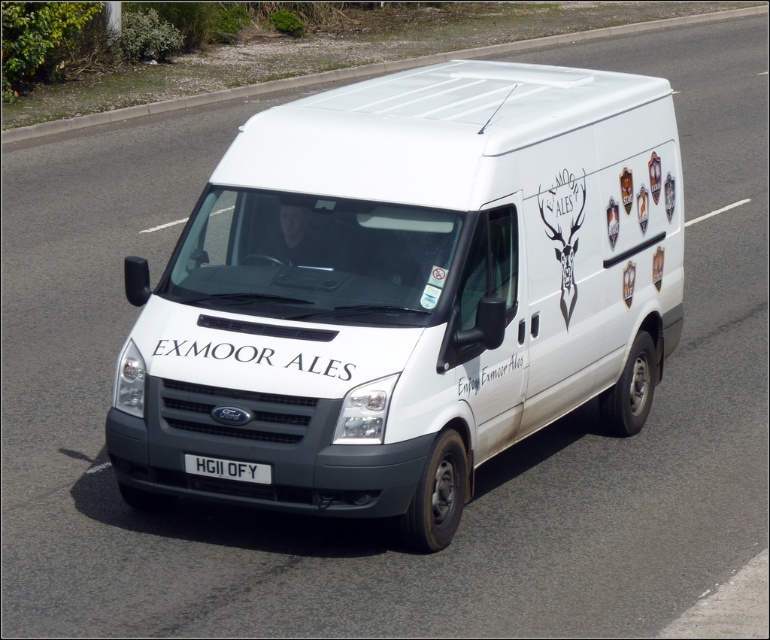
You are a delivery driver who needs to park the white matte van at center in a designated parking spot. The parking spot is located at point 0.455, 0.530. Can you confirm if the van is already positioned correctly over the parking spot?

The white matte van at center is located at point (407, 291), which matches the coordinates of the parking spot. Therefore, the van is already correctly positioned over the parking spot.

You are a delivery driver looking at the white matte van at center and the white plastic license plate at center on the side of the van. Which object is positioned higher up on the vehicle?

The white matte van at center is positioned higher than the white plastic license plate at center.